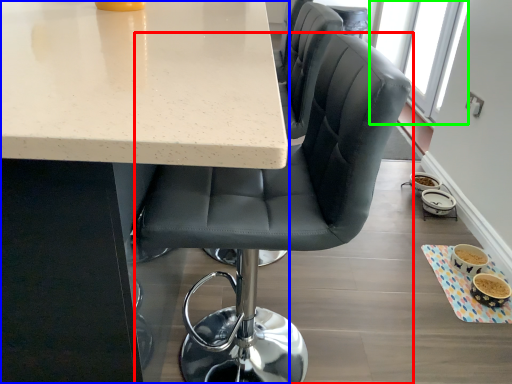
Question: Which object is the closest to the chair (highlighted by a red box)? Choose among these: table (highlighted by a blue box) or window screen (highlighted by a green box).

Choices:
 (A) table
 (B) window screen

Answer: (A)